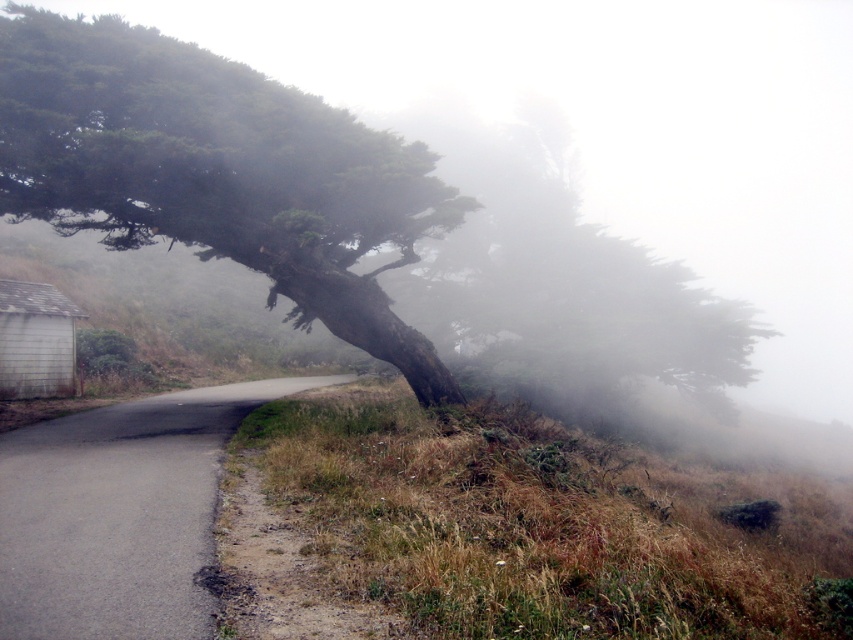
You are a hiker trying to cross the asphalt road at lower left to reach a trail. You notice dry grass at lower right nearby. Which area is more suitable for setting up a lightweight tent, and why?

The dry grass at lower right is more suitable for setting up a lightweight tent because it has a larger size compared to the asphalt road at lower left, providing a more stable and level surface.

You are a hiker standing at the starting point of the rural road. You see a point marked at coordinates (218,172). Which object does this point indicate?

The point at coordinates (218,172) indicates the green rough bark tree at upper left.